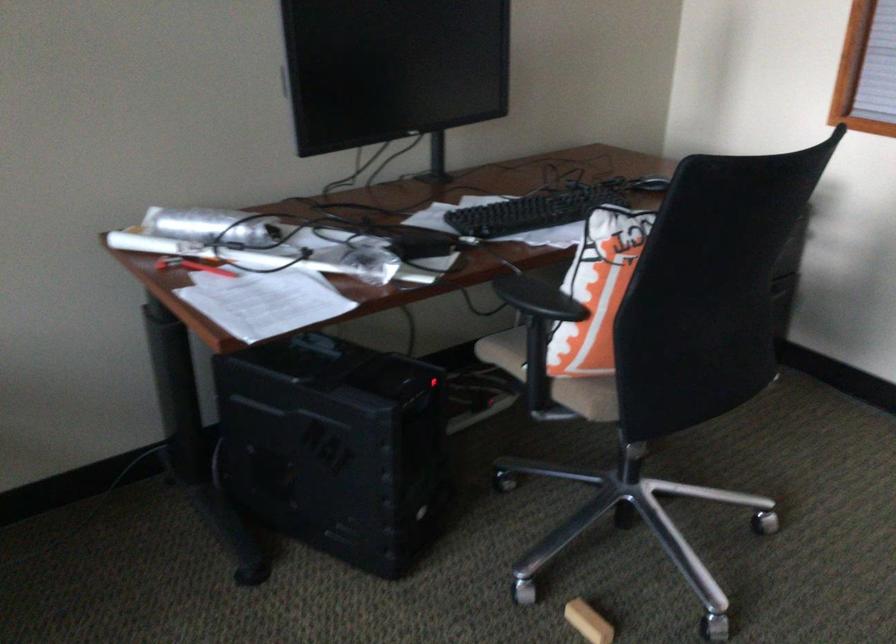
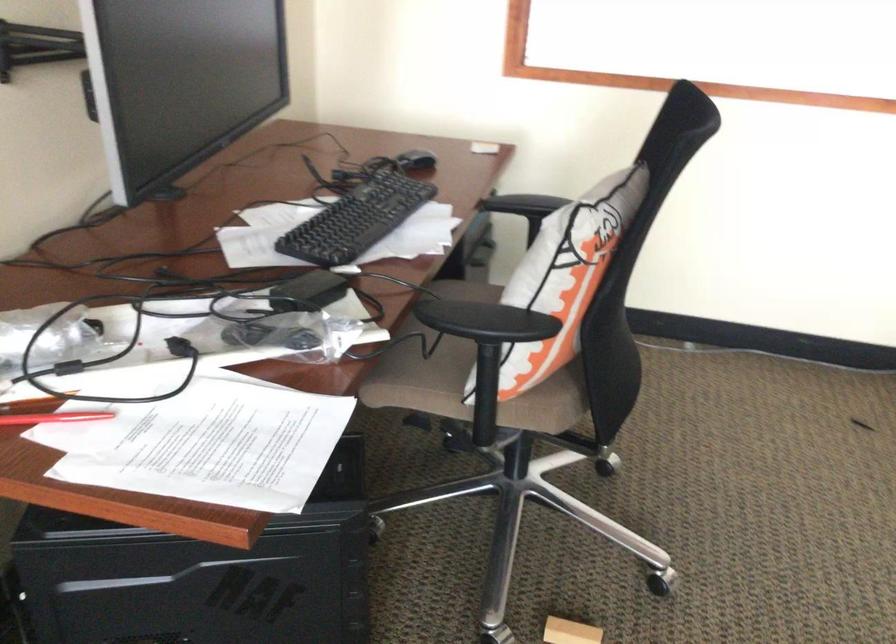
In the second image, find the point that corresponds to the point at 583,270 in the first image.

(564, 277)